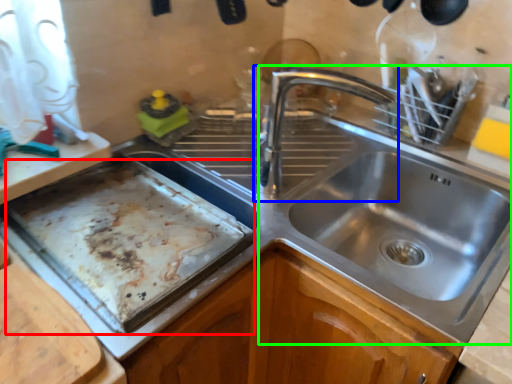
Question: Considering the real-world distances, which object is farthest from baking sheet (highlighted by a red box)? tap (highlighted by a blue box) or sink (highlighted by a green box)?

Choices:
 (A) tap
 (B) sink

Answer: (B)